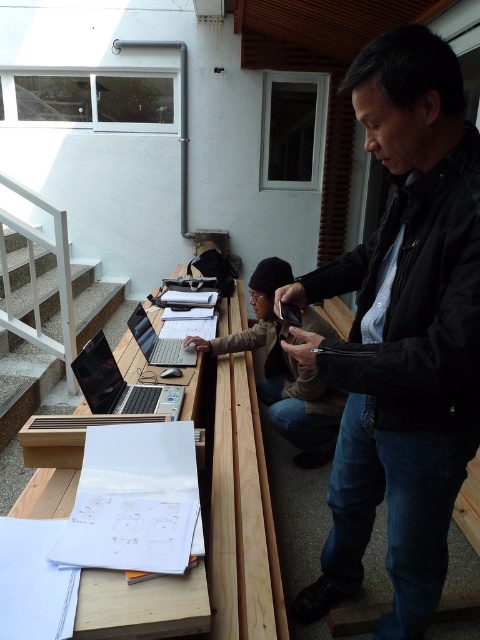
You are organizing a small outdoor meeting and need to place a 1.5 meter long tablecloth on the wooden desk at center. Can the black leather jacket at center currently on the desk be moved to accommodate the tablecloth without removing it from the desk?

The black leather jacket at center occupies less space than wooden desk at center, so there is enough space remaining on the desk to place the 1.5 meter long tablecloth without needing to remove the jacket from the desk.

You are a photographer trying to capture both the shiny black laptop at center and the matte silver laptop at center in a single frame. Given that your camera can only focus on objects within a 10 cm height range, will you be able to capture both laptops clearly?

The shiny black laptop at center is much taller as matte silver laptop at center. Since the height difference between them is significant, it might exceed the 10 cm focus range of your camera. You might need to adjust your position or use a different camera setting to ensure both are in focus.

Consider the image. You are standing at the bottom of the staircase leading to the building. You need to place a large box on the wooden table at center and the wooden desk at center. Which object should you approach first to place the box without moving the staircase?

You should place the box on the wooden desk at center first because the wooden table at center is to the left of the wooden desk at center, so the desk is closer to the staircase and easier to access without moving the staircase.